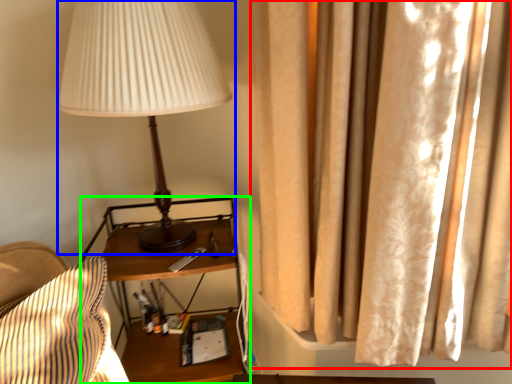
Question: Considering the real-world distances, which object is closest to curtain (highlighted by a red box)? lamp (highlighted by a blue box) or nightstand (highlighted by a green box).

Choices:
 (A) lamp
 (B) nightstand

Answer: (A)